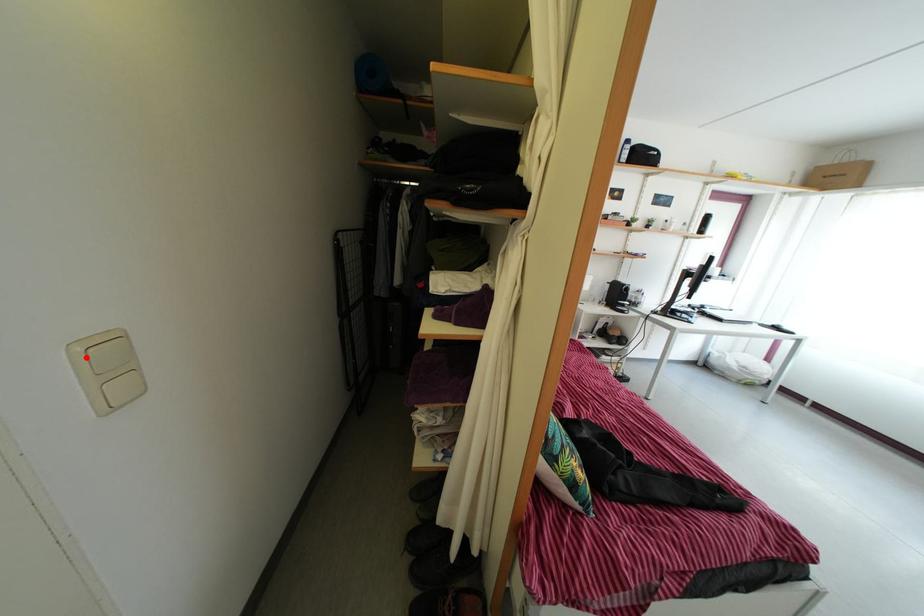
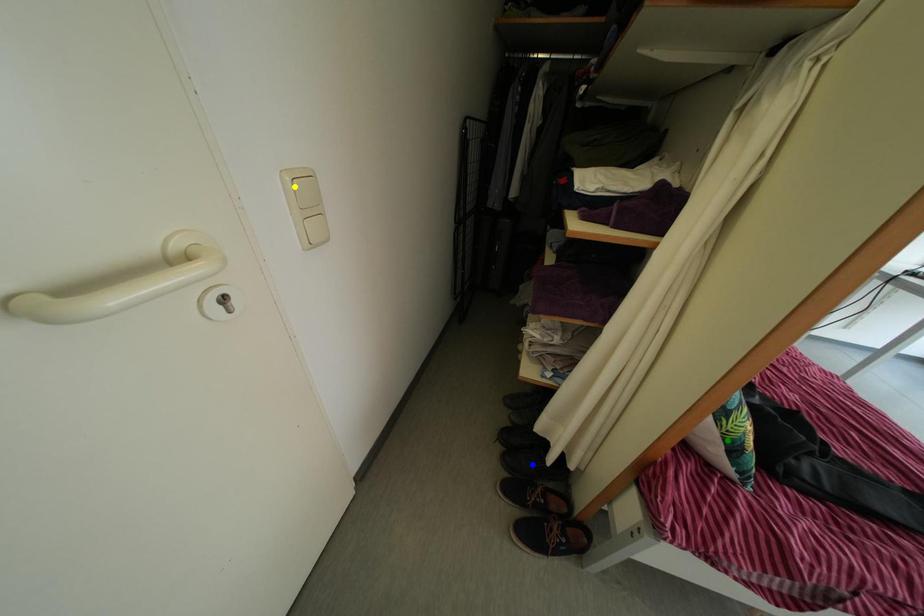
Question: I am providing you with two images of the same scene from different viewpoints. A red point is marked on the first image. You are given multiple points on the second image. In image 2, which mark is for the same physical point as the one in image 1?

Choices:
 (A) blue point
 (B) yellow point
 (C) green point

Answer: (B)